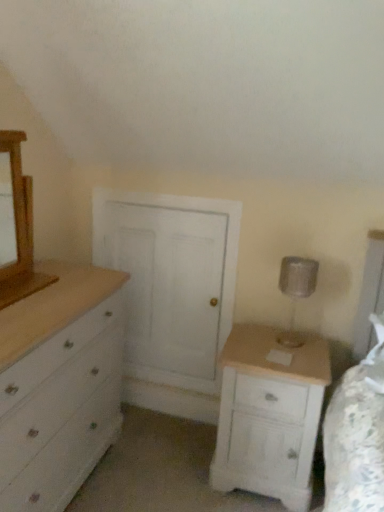
This screenshot has width=384, height=512. I want to click on vacant space in front of silver metallic table lamp at right, so click(298, 350).